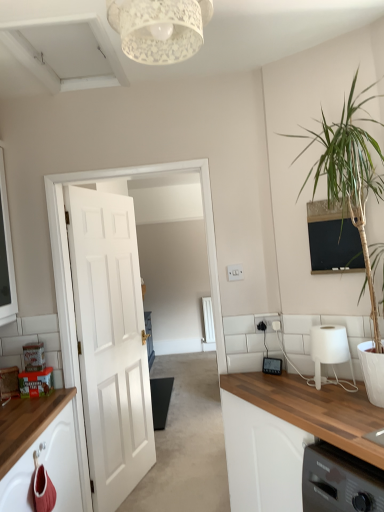
Question: Would you say white lace lampshade at upper center is to the left or to the right of white glossy door at center in the picture?

Choices:
 (A) right
 (B) left

Answer: (A)

Question: Is white lace lampshade at upper center in front of or behind white glossy door at center in the image?

Choices:
 (A) front
 (B) behind

Answer: (A)

Question: Considering the real-world distances, which object is farthest from the green leafy plant at right?

Choices:
 (A) white matte lamp at right
 (B) matte black thermostat at center
 (C) white glossy door at center
 (D) white painted wood door at left
 (E) white lace lampshade at upper center

Answer: (D)

Question: Which of these objects is positioned closest to the matte black thermostat at center?

Choices:
 (A) white matte lamp at right
 (B) white painted wood door at left
 (C) white glossy door at center
 (D) white lace lampshade at upper center
 (E) green leafy plant at right

Answer: (A)